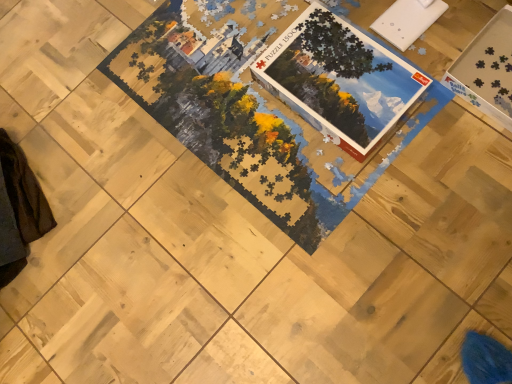
At what (x,y) coordinates should I click in order to perform the action: click on unoccupied area in front of matte cardboard puzzle box at center. Please return your answer as a coordinate pair (x, y). This screenshot has height=384, width=512. Looking at the image, I should click on (352, 175).